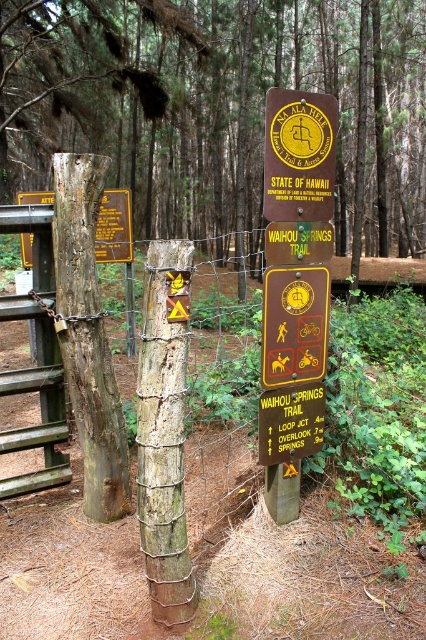
Does weathered wood sign at center appear over yellowmaterial/texturewarning sign at upper center?

No.

You are a GUI agent. You are given a task and a screenshot of the screen. Output one action in this format:
    pyautogui.click(x=<x>, y=<y>)
    Task: Click on the weathered wood sign at center
    This screenshot has width=426, height=640.
    Given the screenshot: What is the action you would take?
    pyautogui.click(x=164, y=432)

Who is more distant from viewer, (155,474) or (328,236)?

The point (328,236) is behind.

Find the location of a particular element. weathered wood sign at center is located at coordinates (164, 432).

Does brown rough wood at center appear over yellowmaterial/texturewarning sign at center?

Correct, brown rough wood at center is located above yellowmaterial/texturewarning sign at center.

How distant is brown rough wood at center from yellowmaterial/texturewarning sign at center?

brown rough wood at center is 47.34 feet from yellowmaterial/texturewarning sign at center.

Locate an element on the screen. brown rough wood at center is located at coordinates pos(215,106).

Is point (172, 369) farther from camera compared to point (324, 296)?

No, it is in front of (324, 296).

Can you confirm if weathered wood sign at center is positioned to the right of yellow plastic warning sign at center?

Incorrect, weathered wood sign at center is not on the right side of yellow plastic warning sign at center.

Which is behind, point (155, 568) or point (275, 314)?

Positioned behind is point (275, 314).

At what (x,y) coordinates should I click in order to perform the action: click on weathered wood sign at center. Please return your answer as a coordinate pair (x, y). The image size is (426, 640). Looking at the image, I should click on (164, 432).